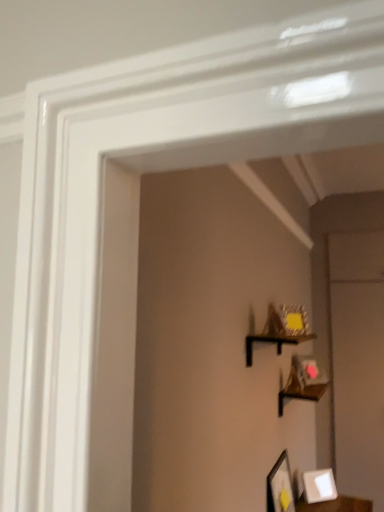
Question: Is white matte picture frame at lower right, acting as the 1th picture frame starting from the back, behind black matte shelf at upper center?

Choices:
 (A) yes
 (B) no

Answer: (A)

Question: Can you confirm if white matte picture frame at lower right, arranged as the first picture frame when viewed from the right, is thinner than black matte shelf at upper center?

Choices:
 (A) yes
 (B) no

Answer: (A)

Question: From a real-world perspective, is white matte picture frame at lower right, which ranks as the second picture frame in left-to-right order, located beneath black matte shelf at upper center?

Choices:
 (A) yes
 (B) no

Answer: (A)

Question: Does white matte picture frame at lower right, acting as the 1th picture frame starting from the back, turn towards black matte shelf at upper center?

Choices:
 (A) yes
 (B) no

Answer: (B)

Question: From a real-world perspective, is white matte picture frame at lower right, arranged as the first picture frame when viewed from the right, on top of black matte shelf at upper center?

Choices:
 (A) yes
 (B) no

Answer: (B)

Question: Based on their sizes in the image, would you say black matte shelf at upper center is bigger or smaller than white matte picture frame at lower right, the 2th picture frame when ordered from front to back?

Choices:
 (A) small
 (B) big

Answer: (B)

Question: In the image, is black matte shelf at upper center positioned in front of or behind white matte picture frame at lower right, acting as the 1th picture frame starting from the back?

Choices:
 (A) behind
 (B) front

Answer: (B)

Question: Is point [x=288, y=338] positioned closer to the camera than point [x=319, y=480]?

Choices:
 (A) closer
 (B) farther

Answer: (A)

Question: Would you say black matte shelf at upper center is to the left or to the right of white matte picture frame at lower right, arranged as the first picture frame when viewed from the right, in the picture?

Choices:
 (A) left
 (B) right

Answer: (A)

Question: Is point (269, 489) closer or farther from the camera than point (244, 345)?

Choices:
 (A) farther
 (B) closer

Answer: (A)

Question: Relative to black matte shelf at upper center, is matte black picture frame at lower right, the 1th picture frame in the front-to-back sequence, in front or behind?

Choices:
 (A) front
 (B) behind

Answer: (B)

Question: Is matte black picture frame at lower right, positioned as the second picture frame in back-to-front order, taller or shorter than black matte shelf at upper center?

Choices:
 (A) short
 (B) tall

Answer: (B)

Question: From the image's perspective, is matte black picture frame at lower right, the 1th picture frame in the left-to-right sequence, positioned above or below black matte shelf at upper center?

Choices:
 (A) below
 (B) above

Answer: (A)

Question: Considering the positions of white matte picture frame at lower right, arranged as the first picture frame when viewed from the right, and black matte shelf at upper center in the image, is white matte picture frame at lower right, arranged as the first picture frame when viewed from the right, wider or thinner than black matte shelf at upper center?

Choices:
 (A) wide
 (B) thin

Answer: (B)

Question: Considering the relative positions of white matte picture frame at lower right, which ranks as the second picture frame in left-to-right order, and black matte shelf at upper center in the image provided, is white matte picture frame at lower right, which ranks as the second picture frame in left-to-right order, to the left or to the right of black matte shelf at upper center?

Choices:
 (A) left
 (B) right

Answer: (B)